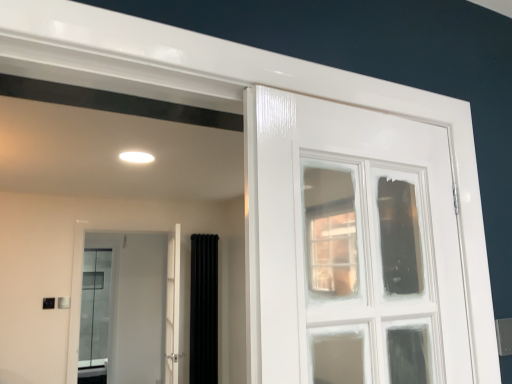
What do you see at coordinates (137, 303) in the screenshot?
I see `white glossy door at center` at bounding box center [137, 303].

Where is `black velvet curtain at center`? black velvet curtain at center is located at coordinates (204, 309).

The image size is (512, 384). I want to click on white glossy door at center, so click(173, 307).

Is point (155, 273) less distant than point (206, 345)?

That is False.

Which of these two, white glossy door at center or black velvet curtain at center, stands taller?

Standing taller between the two is white glossy door at center.

Who is smaller, white glossy door at center or black velvet curtain at center?

Smaller between the two is black velvet curtain at center.

Do you think white glossy door at center is within black velvet curtain at center, or outside of it?

white glossy door at center is outside black velvet curtain at center.

How different are the orientations of white glossy door at center and white glossy door at center in degrees?

There is a 101-degree angle between the facing directions of white glossy door at center and white glossy door at center.

Is white glossy door at center closer to the viewer compared to white glossy door at center?

Yes, white glossy door at center is in front of white glossy door at center.

From a real-world perspective, who is located lower, white glossy door at center or white glossy door at center?

white glossy door at center, from a real-world perspective.

Which is nearer, (x=168, y=318) or (x=178, y=268)?

Point (x=168, y=318) is positioned closer to the camera compared to point (x=178, y=268).

Considering the relative positions of black velvet curtain at center and white glossy door at center in the image provided, is black velvet curtain at center to the right of white glossy door at center from the viewer's perspective?

Indeed, black velvet curtain at center is positioned on the right side of white glossy door at center.

Based on their sizes in the image, would you say black velvet curtain at center is bigger or smaller than white glossy door at center?

black velvet curtain at center is smaller than white glossy door at center.

Considering the sizes of black velvet curtain at center and white glossy door at center in the image, is black velvet curtain at center wider or thinner than white glossy door at center?

Clearly, black velvet curtain at center has less width compared to white glossy door at center.

Identify the location of curtain on the right of white glossy door at center. This screenshot has height=384, width=512. (204, 309).

Considering the positions of objects white glossy door at center and black velvet curtain at center in the image provided, who is in front, white glossy door at center or black velvet curtain at center?

white glossy door at center is more forward.

Is black velvet curtain at center at the back of white glossy door at center?

Yes, white glossy door at center's orientation is away from black velvet curtain at center.

Is white glossy door at center not near black velvet curtain at center?

Actually, white glossy door at center and black velvet curtain at center are a little close together.

Is white glossy door at center spatially inside white glossy door at center, or outside of it?

white glossy door at center exists outside the volume of white glossy door at center.

Looking at this image, between white glossy door at center and white glossy door at center, which one has larger width?

Wider between the two is white glossy door at center.

Does white glossy door at center have a larger size compared to white glossy door at center?

No, white glossy door at center is not bigger than white glossy door at center.

What's the angular difference between white glossy door at center and white glossy door at center's facing directions?

white glossy door at center and white glossy door at center are facing 101 degrees away from each other.

Where is `curtain behind the white glossy door at center`? This screenshot has height=384, width=512. curtain behind the white glossy door at center is located at coordinates (204, 309).

Considering the points (205, 287) and (168, 297), which point is behind, point (205, 287) or point (168, 297)?

The point (205, 287) is behind.

How many degrees apart are the facing directions of black velvet curtain at center and white glossy door at center?

The facing directions of black velvet curtain at center and white glossy door at center are 0.000751 degrees apart.

Are black velvet curtain at center and white glossy door at center far apart?

Yes, black velvet curtain at center and white glossy door at center are located far from each other.

The width and height of the screenshot is (512, 384). I want to click on curtain beneath the white glossy door at center (from a real-world perspective), so click(204, 309).

Where is `screen door above the white glossy door at center (from the image's perspective)`? screen door above the white glossy door at center (from the image's perspective) is located at coordinates (173, 307).

Based on their spatial positions, is black velvet curtain at center or white glossy door at center closer to white glossy door at center?

Among the two, black velvet curtain at center is located nearer to white glossy door at center.

Based on their spatial positions, is white glossy door at center or white glossy door at center further from black velvet curtain at center?

Based on the image, white glossy door at center appears to be further to black velvet curtain at center.

Looking at this image, looking at the image, which one is located closer to white glossy door at center, black velvet curtain at center or white glossy door at center?

black velvet curtain at center is closer to white glossy door at center.

Which object lies further to the anchor point white glossy door at center, white glossy door at center or black velvet curtain at center?

The object further to white glossy door at center is white glossy door at center.

Considering their positions, is white glossy door at center positioned further to white glossy door at center than black velvet curtain at center?

white glossy door at center lies further to white glossy door at center than the other object.

Estimate the real-world distances between objects in this image. Which object is further from black velvet curtain at center, white glossy door at center or white glossy door at center?

white glossy door at center is further to black velvet curtain at center.

Where is `door between white glossy door at center and black velvet curtain at center in the front-back direction`? The height and width of the screenshot is (384, 512). door between white glossy door at center and black velvet curtain at center in the front-back direction is located at coordinates (137, 303).